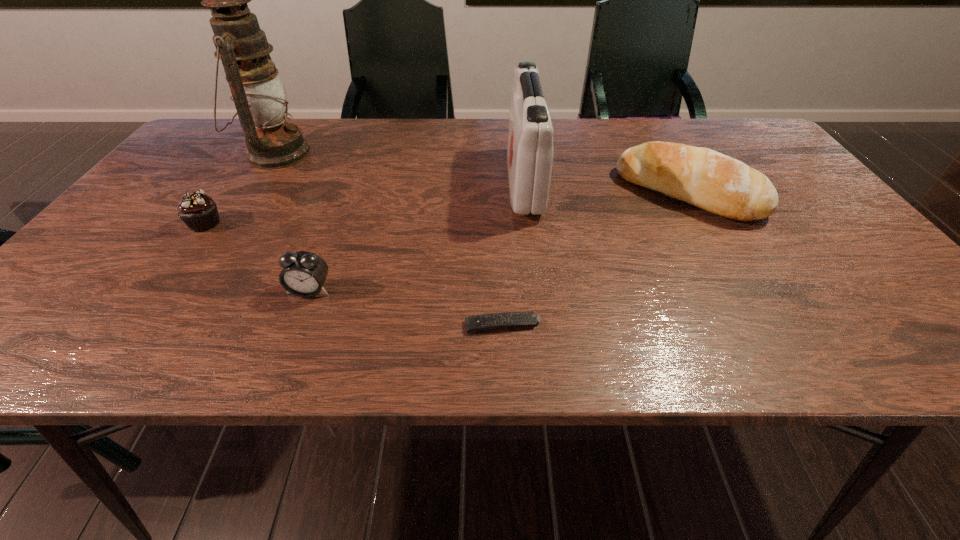
I want to click on vacant space located 0.370m on the front side of the second tallest object, so click(x=364, y=183).

At what (x,y) coordinates should I click in order to perform the action: click on blank area located on the front side of the second tallest object. Please return your answer as a coordinate pair (x, y). This screenshot has height=540, width=960. Looking at the image, I should click on (372, 183).

Find the location of a particular element. This screenshot has height=540, width=960. free space located on the front side of the second tallest object is located at coordinates (485, 183).

Where is `free region located on the front of the bread`? This screenshot has height=540, width=960. free region located on the front of the bread is located at coordinates (769, 333).

The image size is (960, 540). What are the coordinates of `free region located on the front side of the third object from left to right` in the screenshot? It's located at point(297,325).

Locate an element on the screen. The height and width of the screenshot is (540, 960). vacant space located 0.080m on the right of the cupcake is located at coordinates (257, 224).

This screenshot has width=960, height=540. I want to click on vacant space located on the back of the remote control, so click(x=497, y=194).

The image size is (960, 540). Identify the location of lantern that is at the far edge. (258, 94).

Locate an element on the screen. Image resolution: width=960 pixels, height=540 pixels. the first-aid kit that is positioned at the far edge is located at coordinates [x=530, y=151].

Identify the location of object that is at the near edge. (483, 322).